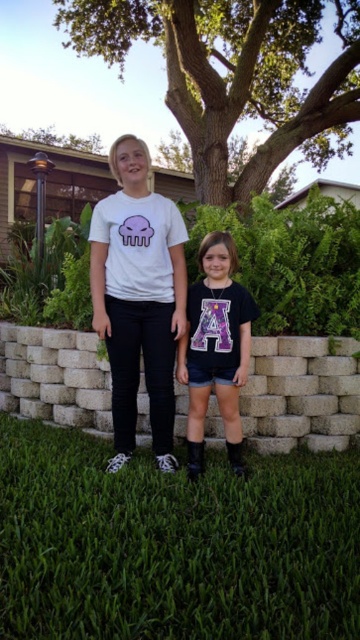
Question: Which of the following is the farthest from the observer?

Choices:
 (A) (210, 280)
 (B) (261, 48)

Answer: (B)

Question: Can you confirm if green grass at center is positioned to the left of purple glittery letter a at center?

Choices:
 (A) no
 (B) yes

Answer: (B)

Question: Does green leafy tree at upper center have a larger size compared to white matte t-shirt at center?

Choices:
 (A) no
 (B) yes

Answer: (B)

Question: Which point is farther to the camera?

Choices:
 (A) green grass at center
 (B) green leafy tree at upper center
 (C) purple glittery letter a at center
 (D) white matte t-shirt at center

Answer: (B)

Question: Which of the following is the farthest from the observer?

Choices:
 (A) purple glittery letter a at center
 (B) green grass at center
 (C) white matte t-shirt at center

Answer: (C)

Question: Can you confirm if green grass at center is thinner than white matte t-shirt at center?

Choices:
 (A) no
 (B) yes

Answer: (A)